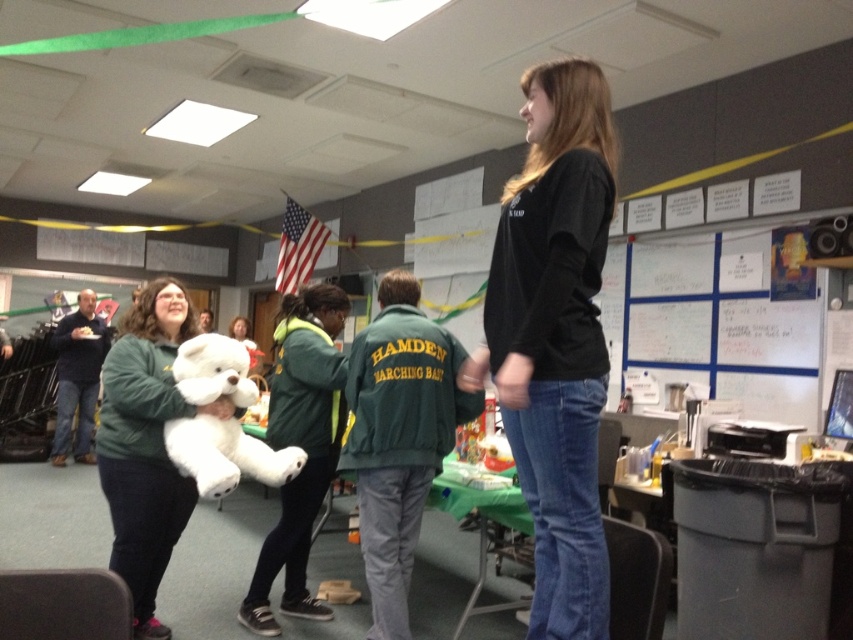
Does point (701, 292) come in front of point (149, 456)?

No.

Who is more distant from viewer, (788, 316) or (154, 381)?

The point (788, 316) is more distant.

Does point (636, 262) come behind point (154, 621)?

Yes.

Identify the location of whiteboard at upper right. (722, 323).

Measure the distance from green fleece jacket at center to white plush teddy bear at center.

They are 44.81 centimeters apart.

Does green fleece jacket at center appear on the left side of white plush teddy bear at center?

Incorrect, green fleece jacket at center is not on the left side of white plush teddy bear at center.

Who is more distant from viewer, (x=277, y=557) or (x=181, y=353)?

Positioned behind is point (x=277, y=557).

The height and width of the screenshot is (640, 853). I want to click on green fleece jacket at center, so click(x=300, y=445).

Between green fleece jacket at left and green fleece jacket at center, which one is positioned higher?

Positioned higher is green fleece jacket at left.

Who is positioned more to the right, green fleece jacket at left or green fleece jacket at center?

green fleece jacket at center is more to the right.

This screenshot has width=853, height=640. What do you see at coordinates (144, 445) in the screenshot?
I see `green fleece jacket at left` at bounding box center [144, 445].

Locate an element on the screen. The image size is (853, 640). green fleece jacket at left is located at coordinates (144, 445).